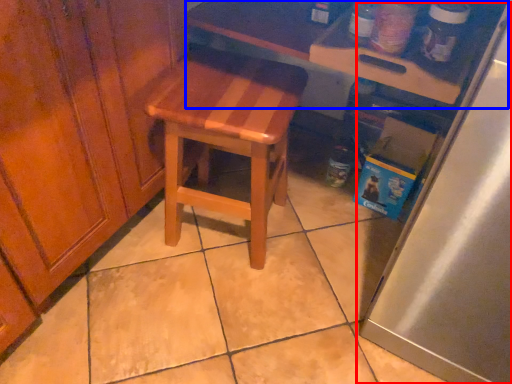
Question: Among these objects, which one is nearest to the camera, appliance (highlighted by a red box) or table (highlighted by a blue box)?

Choices:
 (A) appliance
 (B) table

Answer: (A)